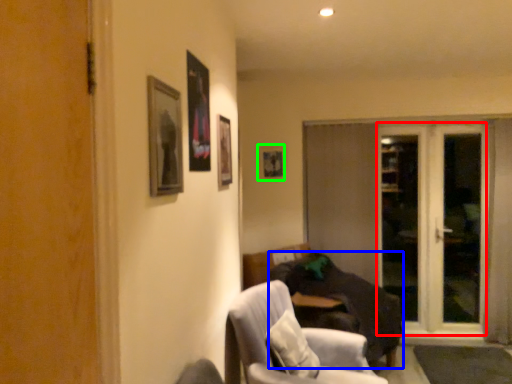
Question: Estimate the real-world distances between objects in this image. Which object is farther from screen door (highlighted by a red box), studio couch (highlighted by a blue box) or picture frame (highlighted by a green box)?

Choices:
 (A) studio couch
 (B) picture frame

Answer: (B)